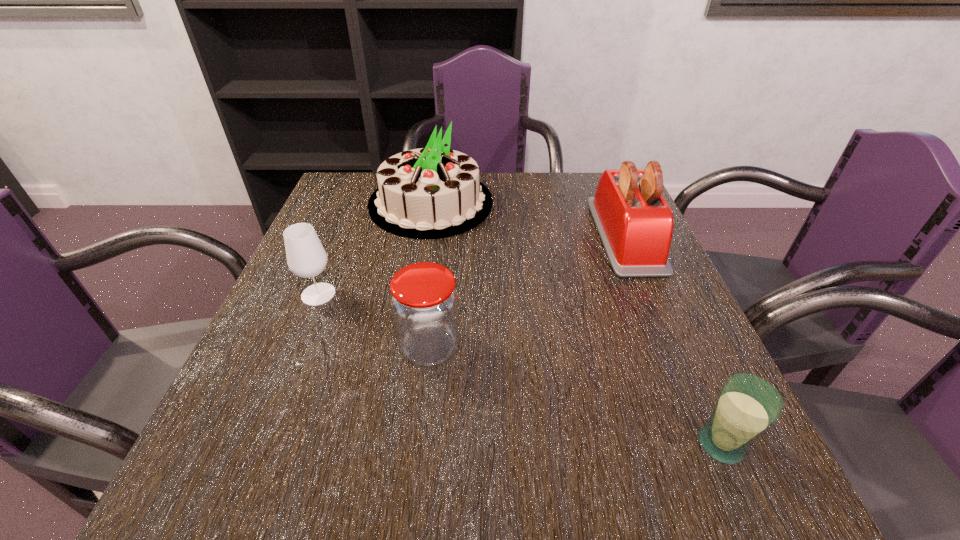
Identify the location of free space located on the back of the third farthest object. The image size is (960, 540). (348, 220).

Locate an element on the screen. vacant space located on the left of the shortest object is located at coordinates (618, 444).

Image resolution: width=960 pixels, height=540 pixels. What are the coordinates of `birthday cake at the far edge` in the screenshot? It's located at (435, 192).

Where is `toaster located at the far edge`? The width and height of the screenshot is (960, 540). toaster located at the far edge is located at coordinates (635, 223).

Locate an element on the screen. This screenshot has width=960, height=540. object at the near edge is located at coordinates (747, 406).

The height and width of the screenshot is (540, 960). I want to click on birthday cake that is positioned at the left edge, so click(x=435, y=192).

What are the coordinates of `glass that is at the left edge` in the screenshot? It's located at (306, 257).

I want to click on toaster located in the right edge section of the desktop, so click(635, 223).

Where is `glass that is at the right edge`? glass that is at the right edge is located at coordinates (747, 406).

Find the location of a particular element. The image size is (960, 540). object that is positioned at the far left corner is located at coordinates (435, 192).